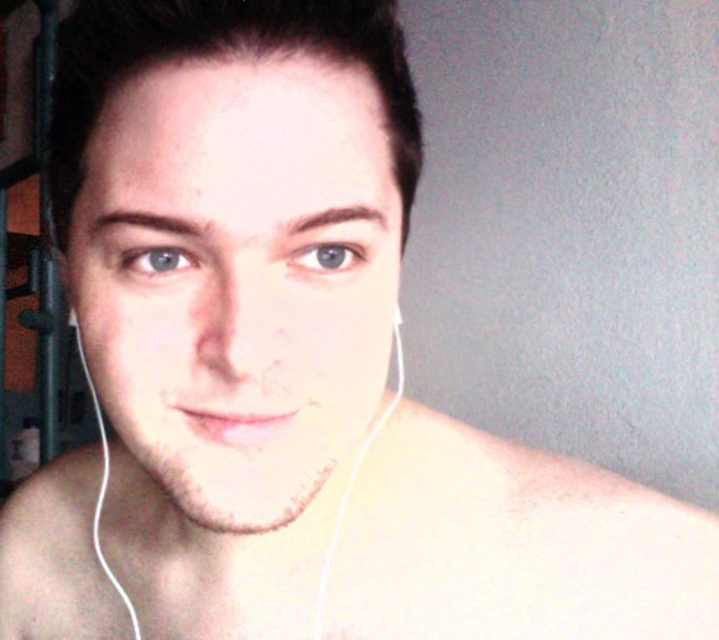
From the picture: Which of these two, smooth skin earphones at center or white earphone at left, stands taller?

smooth skin earphones at center

Can you confirm if smooth skin earphones at center is positioned below white earphone at left?

Yes, smooth skin earphones at center is below white earphone at left.

Is point (403, 387) closer to camera compared to point (393, 321)?

No, (403, 387) is behind (393, 321).

You are a GUI agent. You are given a task and a screenshot of the screen. Output one action in this format:
    pyautogui.click(x=<x>, y=<y>)
    Task: Click on the smooth skin earphones at center
    The height and width of the screenshot is (640, 719).
    Given the screenshot: What is the action you would take?
    pyautogui.click(x=352, y=488)